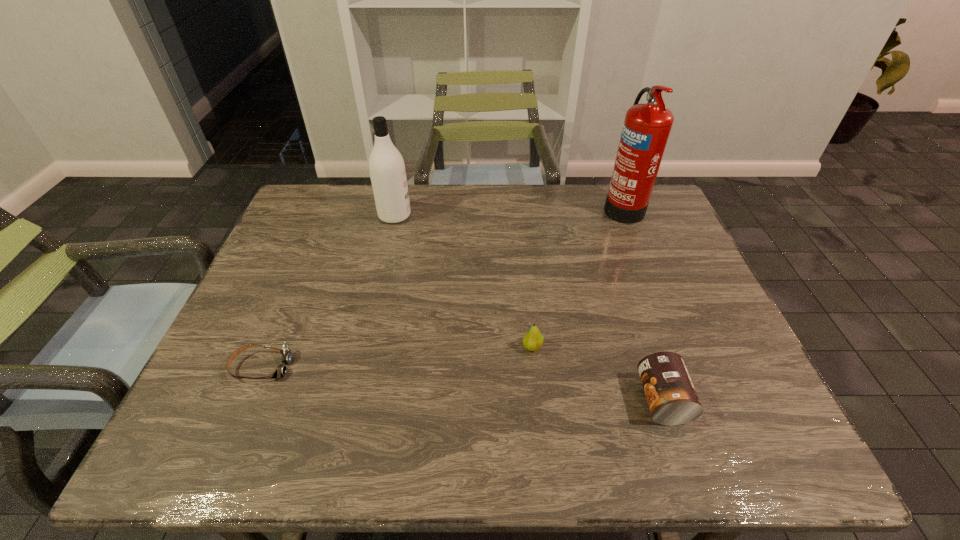
The width and height of the screenshot is (960, 540). Identify the location of blank region between the leftmost object and the fire extinguisher. (442, 287).

Identify the location of vacant area that lies between the can and the shampoo. The height and width of the screenshot is (540, 960). (528, 307).

Identify the location of free area in between the tallest object and the can. This screenshot has height=540, width=960. (642, 303).

I want to click on vacant area that lies between the fire extinguisher and the fourth object from right to left, so click(509, 211).

Locate an element on the screen. Image resolution: width=960 pixels, height=540 pixels. free space between the pear and the fire extinguisher is located at coordinates tap(577, 276).

Identify the location of vacant space that's between the second tallest object and the can. The width and height of the screenshot is (960, 540). (528, 307).

What are the coordinates of `the fourth closest object to the fire extinguisher` in the screenshot? It's located at (281, 370).

Where is `the third closest object to the fire extinguisher`? the third closest object to the fire extinguisher is located at coordinates click(387, 170).

At what (x,y) coordinates should I click in order to perform the action: click on free space in the image that satisfies the following two spatial constraints: 1. on the front-facing side of the third object from left to right; 2. on the right side of the fourth shortest object. Please return your answer as a coordinate pair (x, y). Looking at the image, I should click on (364, 347).

You are a GUI agent. You are given a task and a screenshot of the screen. Output one action in this format:
    pyautogui.click(x=<x>, y=<y>)
    Task: Click on the free space that satisfies the following two spatial constraints: 1. on the front-facing side of the third object from right to left; 2. on the right side of the second object from left to right
    
    Given the screenshot: What is the action you would take?
    pyautogui.click(x=364, y=347)